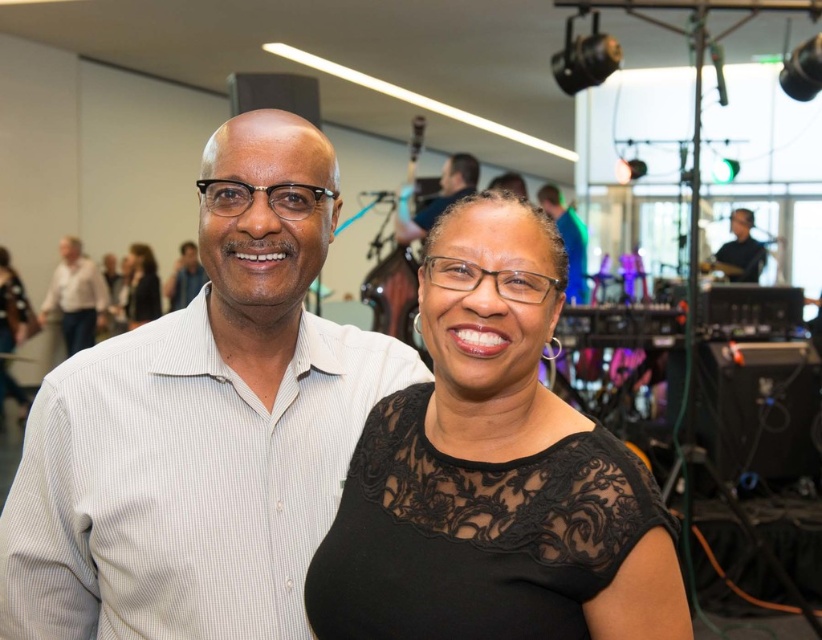
You are a photographer standing at the camera position. You want to take a closeup shot of the black lace dress at center. Can you estimate how far you need to move forward or backward to focus on it?

The black lace dress at center is 36.48 inches away from camera. To take a closeup shot, you would need to move closer to the dress, but since the distance is already specified, adjust your camera settings for focus at that distance.

You are organizing a photo shoot and need to ensure that the black lace dress at center and the matte black guitar at upper center are both visible in the frame. Given their sizes, which object should you prioritize positioning closer to the camera to maintain clarity and detail?

The black lace dress at center is smaller than the matte black guitar at upper center. To ensure clarity and detail, prioritize positioning the black lace dress at center closer to the camera since it is smaller and might require more focus to capture its details effectively.

Looking at this image, you are standing at the entrance of the event venue and want to take a photo of both the black lace dress at center and the matte black guitar at upper center. Given that your camera has a maximum focus range of 10 feet, will you be able to capture both subjects in focus without moving closer?

The black lace dress at center is 11.72 feet away from the matte black guitar at upper center. Since the distance between them exceeds the camera maximum focus range of 10 feet, you won not be able to capture both subjects in focus without moving closer.